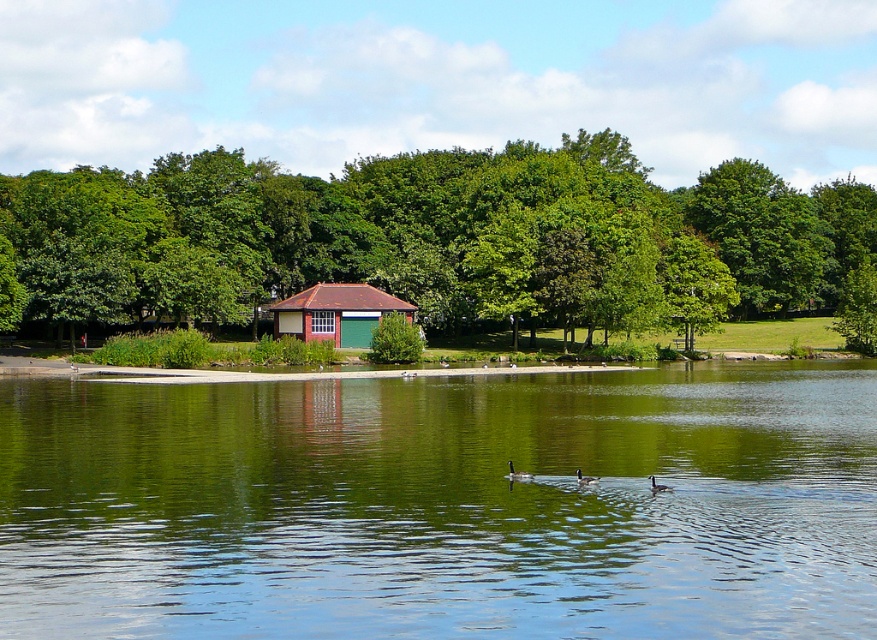
Question: Is green reflective water at center to the left of brown matte duck at center from the viewer's perspective?

Choices:
 (A) no
 (B) yes

Answer: (B)

Question: Can you confirm if green reflective water at center is wider than brown matte duck at center?

Choices:
 (A) no
 (B) yes

Answer: (B)

Question: Which of the following is the closest to the observer?

Choices:
 (A) green reflective water at center
 (B) matte red hut at center

Answer: (A)

Question: Which point is closer to the camera taking this photo?

Choices:
 (A) (651, 486)
 (B) (53, 266)

Answer: (A)

Question: Does green reflective water at center appear under white matte duck at lower center?

Choices:
 (A) no
 (B) yes

Answer: (A)

Question: Which point is closer to the camera?

Choices:
 (A) dark gray matte duck at center
 (B) green leafy tree at center
 (C) white matte duck at lower center
 (D) brown matte duck at center

Answer: (C)